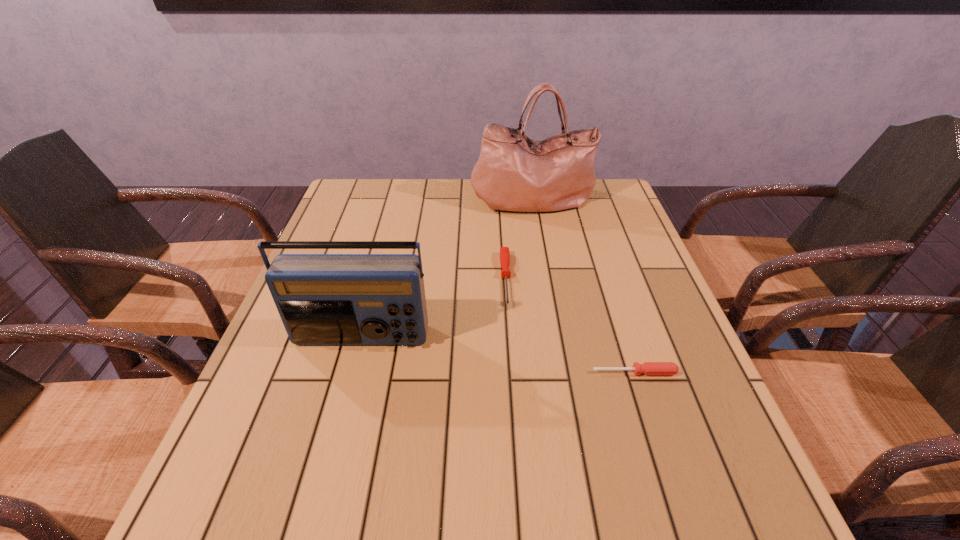
At what (x,y) coordinates should I click in order to perform the action: click on vacant space that is in between the right screwdriver and the second farthest object. Please return your answer as a coordinate pair (x, y). Image resolution: width=960 pixels, height=540 pixels. Looking at the image, I should click on (570, 326).

The image size is (960, 540). What are the coordinates of `free point between the farthest object and the third shortest object` in the screenshot? It's located at (447, 269).

Find the location of a particular element. The height and width of the screenshot is (540, 960). vacant area that lies between the nearest object and the left screwdriver is located at coordinates (570, 326).

Select which object is the third closest to the nearest object. Please provide its 2D coordinates. Your answer should be formatted as a tuple, i.e. [(x, y)], where the tuple contains the x and y coordinates of a point satisfying the conditions above.

[(514, 173)]

Point out which object is positioned as the second nearest to the farther screwdriver. Please provide its 2D coordinates. Your answer should be formatted as a tuple, i.e. [(x, y)], where the tuple contains the x and y coordinates of a point satisfying the conditions above.

[(323, 299)]

Find the location of a particular element. The width and height of the screenshot is (960, 540). free region that satisfies the following two spatial constraints: 1. at the tip of the nearest object; 2. on the left side of the farther screwdriver is located at coordinates (512, 373).

The image size is (960, 540). I want to click on vacant space that satisfies the following two spatial constraints: 1. at the front of the right screwdriver with handles; 2. on the right side of the handbag, so click(563, 373).

Locate an element on the screen. Image resolution: width=960 pixels, height=540 pixels. free region that satisfies the following two spatial constraints: 1. at the front of the right screwdriver with handles; 2. on the right side of the farthest object is located at coordinates (563, 373).

The width and height of the screenshot is (960, 540). Identify the location of free space in the image that satisfies the following two spatial constraints: 1. at the front of the farthest object with handles; 2. on the right side of the nearer screwdriver. (563, 373).

This screenshot has width=960, height=540. I want to click on free space that satisfies the following two spatial constraints: 1. at the front of the right screwdriver with handles; 2. on the right side of the farthest object, so click(563, 373).